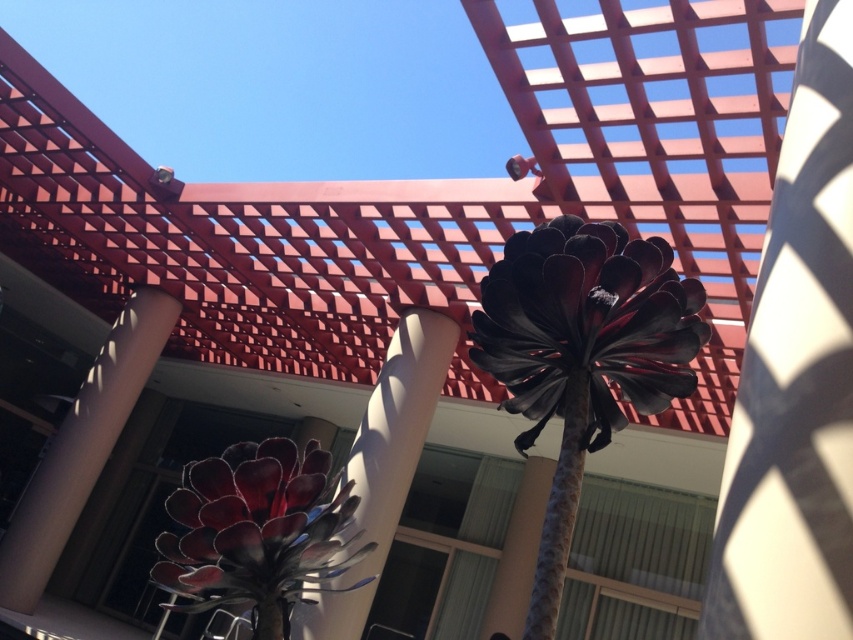
Does metallic red flower at center have a lesser width compared to white glossy pillar at center?

Indeed, metallic red flower at center has a lesser width compared to white glossy pillar at center.

Between metallic red flower at center and white glossy pillar at center, which one appears on the left side from the viewer's perspective?

white glossy pillar at center is more to the left.

Does point (236, 572) come behind point (349, 474)?

No, (236, 572) is closer to viewer.

This screenshot has width=853, height=640. I want to click on metallic red flower at center, so (x=256, y=532).

Can you confirm if metallic black flower at center is positioned above metallic red flower at center?

Indeed, metallic black flower at center is positioned over metallic red flower at center.

Consider the image. Can you confirm if metallic black flower at center is shorter than metallic red flower at center?

Yes.

Who is more distant from viewer, [492,276] or [352,506]?

Positioned behind is point [492,276].

Image resolution: width=853 pixels, height=640 pixels. Find the location of `metallic black flower at center`. metallic black flower at center is located at coordinates (585, 328).

Is metallic black flower at center bigger than white glossy pillar at center?

No.

Can you confirm if metallic black flower at center is taller than white glossy pillar at center?

Incorrect, metallic black flower at center's height is not larger of white glossy pillar at center's.

Does point (502, 355) come closer to viewer compared to point (352, 636)?

Yes.

Where is `metallic black flower at center`? Image resolution: width=853 pixels, height=640 pixels. metallic black flower at center is located at coordinates (585, 328).